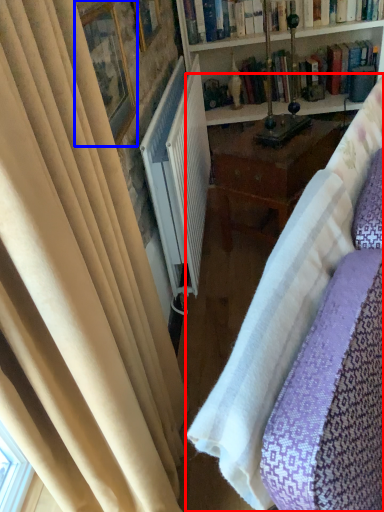
Question: Among these objects, which one is farthest to the camera, studio couch (highlighted by a red box) or picture frame (highlighted by a blue box)?

Choices:
 (A) studio couch
 (B) picture frame

Answer: (B)